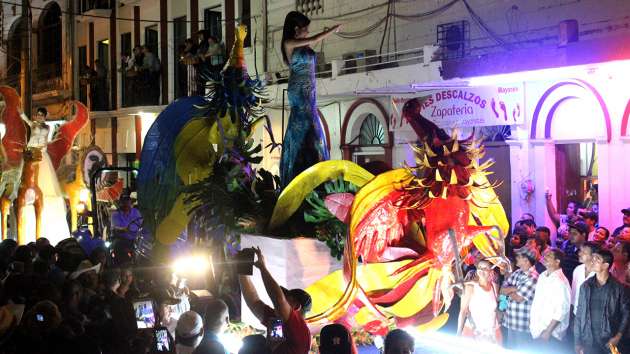
Locate an element on the screen. The width and height of the screenshot is (630, 354). arched window is located at coordinates (370, 129).